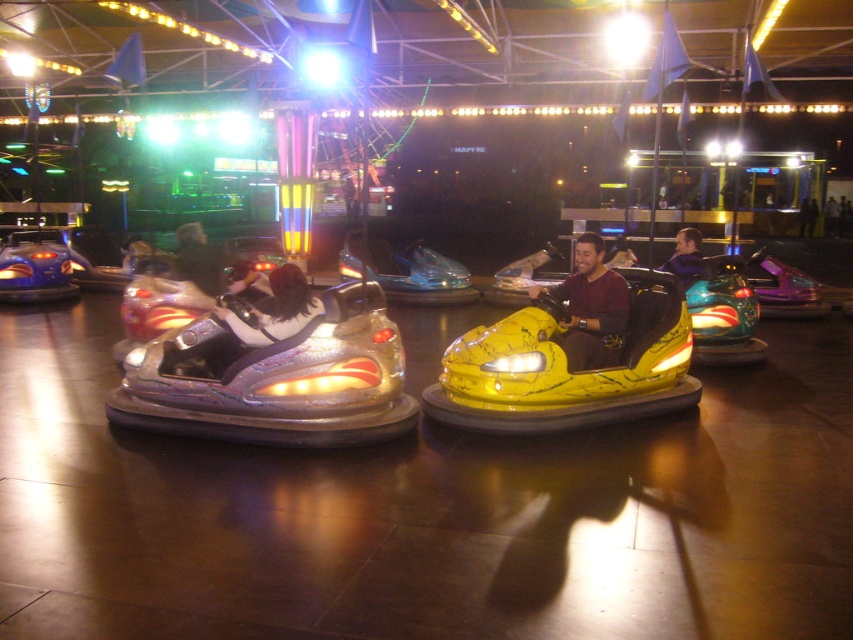
Based on the photo, you are a visitor at the fairground and want to take a photo of both the shiny silver bumper car at left and the maroon jersey at center. Which object should you frame first in your camera viewfinder to ensure both are in the shot?

The shiny silver bumper car at left should be framed first in the camera viewfinder since it is positioned on the left side of the maroon jersey at center, allowing both objects to be captured in the same frame.

You are a visitor at the fairground and want to take a photo of the shiny silver helmet at center and the purple matte jacket at center. Which object should you focus on first to ensure both are in the frame?

The shiny silver helmet at center is in front of the purple matte jacket at center, so you should focus on the shiny silver helmet at center first to ensure both are in the frame.